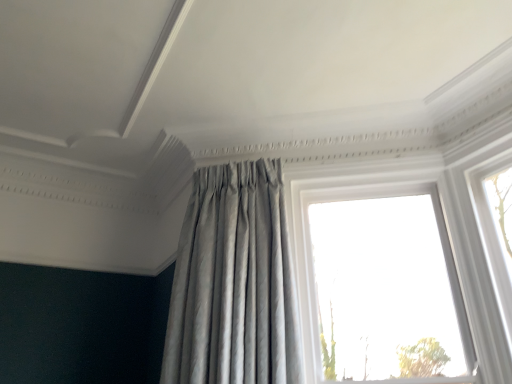
Question: Considering the relative sizes of transparent glass window at upper right and satin silver curtain at center in the image provided, is transparent glass window at upper right thinner than satin silver curtain at center?

Choices:
 (A) no
 (B) yes

Answer: (B)

Question: Could satin silver curtain at center be considered to be inside transparent glass window at upper right?

Choices:
 (A) yes
 (B) no

Answer: (B)

Question: Can you confirm if transparent glass window at upper right is positioned to the right of satin silver curtain at center?

Choices:
 (A) no
 (B) yes

Answer: (B)

Question: Does transparent glass window at upper right have a lesser height compared to satin silver curtain at center?

Choices:
 (A) yes
 (B) no

Answer: (B)

Question: Does transparent glass window at upper right appear on the left side of satin silver curtain at center?

Choices:
 (A) yes
 (B) no

Answer: (B)

Question: Is transparent glass window at upper right placed right next to satin silver curtain at center?

Choices:
 (A) yes
 (B) no

Answer: (B)

Question: Considering the relative sizes of satin silver curtain at center and transparent glass window at upper right in the image provided, is satin silver curtain at center smaller than transparent glass window at upper right?

Choices:
 (A) no
 (B) yes

Answer: (A)

Question: Is satin silver curtain at center further to the viewer compared to transparent glass window at upper right?

Choices:
 (A) no
 (B) yes

Answer: (A)

Question: Is satin silver curtain at center next to transparent glass window at upper right and touching it?

Choices:
 (A) yes
 (B) no

Answer: (B)

Question: Would you consider satin silver curtain at center to be distant from transparent glass window at upper right?

Choices:
 (A) no
 (B) yes

Answer: (A)

Question: From a real-world perspective, is satin silver curtain at center beneath transparent glass window at upper right?

Choices:
 (A) no
 (B) yes

Answer: (A)

Question: Does satin silver curtain at center appear on the left side of transparent glass window at upper right?

Choices:
 (A) yes
 (B) no

Answer: (A)

Question: Would you say satin silver curtain at center is to the left or to the right of transparent glass window at upper right in the picture?

Choices:
 (A) left
 (B) right

Answer: (A)